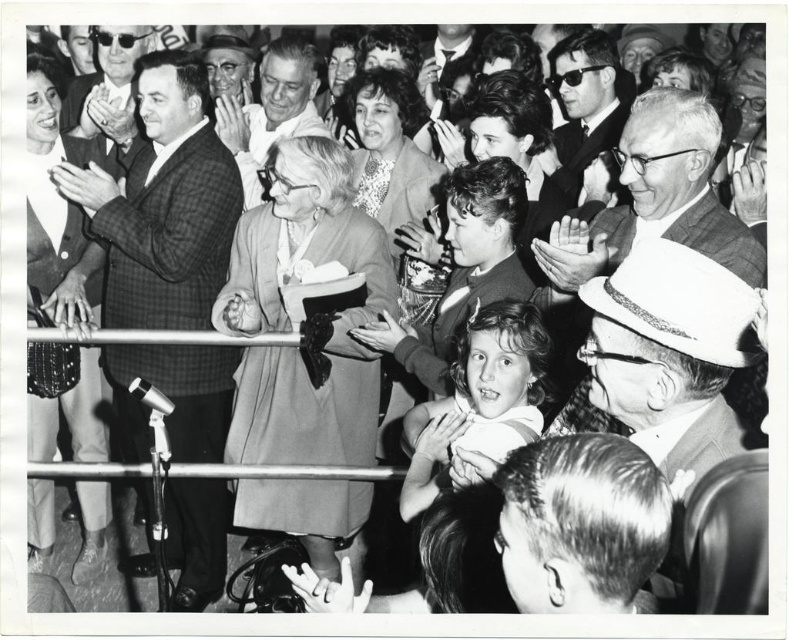
Does smooth gray suit at center appear over smooth gray suit at upper left?

Incorrect, smooth gray suit at center is not positioned above smooth gray suit at upper left.

Between smooth gray suit at center and smooth gray suit at upper left, which one appears on the right side from the viewer's perspective?

smooth gray suit at center is more to the right.

Does point (316, 129) come behind point (208, 60)?

No.

Where is `smooth gray suit at center`? This screenshot has width=789, height=640. smooth gray suit at center is located at coordinates [270, 109].

Which is below, checkered fabric suit at left or smooth gray suit at upper left?

Positioned lower is checkered fabric suit at left.

The image size is (789, 640). Find the location of `checkered fabric suit at left`. checkered fabric suit at left is located at coordinates (163, 204).

Who is more distant from viewer, (189,563) or (252,58)?

Point (252,58)

Where is `checkered fabric suit at left`? The image size is (789, 640). checkered fabric suit at left is located at coordinates (163, 204).

Based on the photo, who is lower down, smooth gray suit at upper right or smooth gray suit at center?

Positioned lower is smooth gray suit at upper right.

Is smooth gray suit at upper right above smooth gray suit at center?

No.

What do you see at coordinates (660, 195) in the screenshot? I see `smooth gray suit at upper right` at bounding box center [660, 195].

Identify the location of smooth gray suit at upper right. (660, 195).